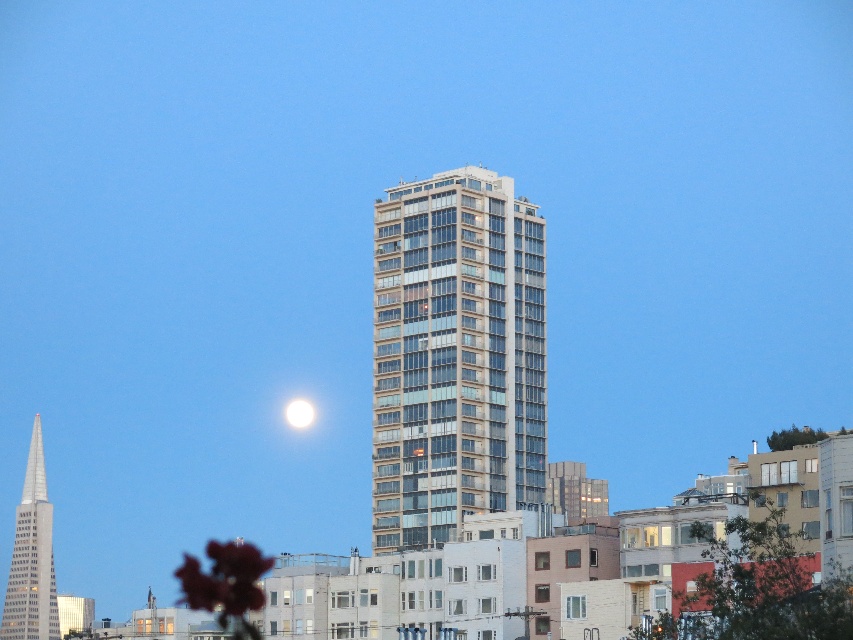
Can you confirm if glassy concrete building at center is positioned below white glossy moon at upper center?

No, glassy concrete building at center is not below white glossy moon at upper center.

Is glassy concrete building at center smaller than white glossy moon at upper center?

Actually, glassy concrete building at center might be larger than white glossy moon at upper center.

Does point (482, 464) come closer to viewer compared to point (311, 420)?

Yes, point (482, 464) is in front of point (311, 420).

Locate an element on the screen. The image size is (853, 640). glassy concrete building at center is located at coordinates (456, 355).

Locate an element on the screen. The width and height of the screenshot is (853, 640). glassy concrete building at center is located at coordinates (456, 355).

Looking at this image, how distant is glassy concrete building at center from polished glass skyscraper at left?

A distance of 186.97 meters exists between glassy concrete building at center and polished glass skyscraper at left.

Measure the distance between point (537, 230) and camera.

Point (537, 230) is 748.92 feet from camera.

This screenshot has height=640, width=853. Identify the location of glassy concrete building at center. (456, 355).

Between polished glass skyscraper at left and white glossy moon at upper center, which one appears on the right side from the viewer's perspective?

From the viewer's perspective, white glossy moon at upper center appears more on the right side.

Which of these two, polished glass skyscraper at left or white glossy moon at upper center, stands shorter?

white glossy moon at upper center is shorter.

Between point (12, 564) and point (306, 419), which one is positioned in front?

Positioned in front is point (12, 564).

At what (x,y) coordinates should I click in order to perform the action: click on polished glass skyscraper at left. Please return your answer as a coordinate pair (x, y). Image resolution: width=853 pixels, height=640 pixels. Looking at the image, I should click on (32, 556).